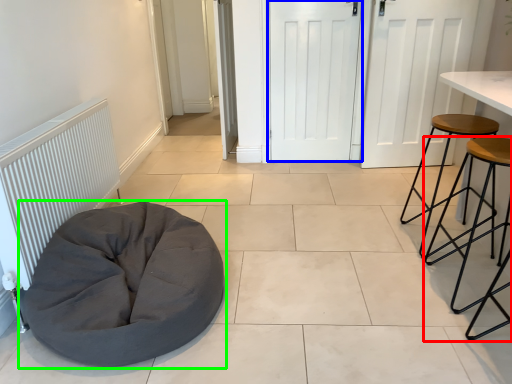
Question: Based on their relative distances, which object is farther from stool (highlighted by a red box)? Choose from door (highlighted by a blue box) and furniture (highlighted by a green box).

Choices:
 (A) door
 (B) furniture

Answer: (A)